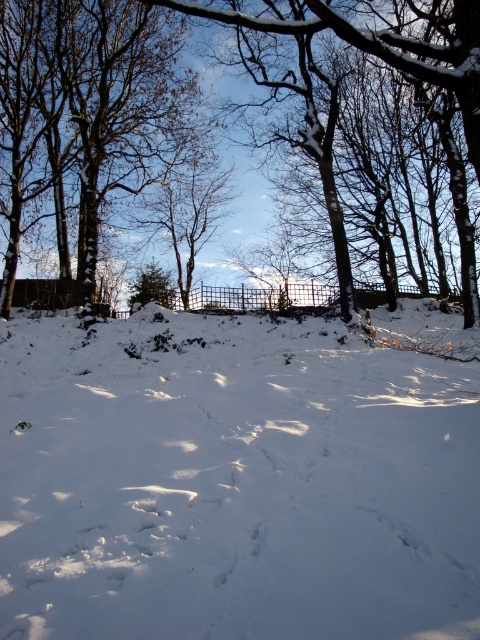
Question: Where is smooth bark tree at upper left located in relation to snow-covered tree at center in the image?

Choices:
 (A) right
 (B) left

Answer: (B)

Question: Which object appears closest to the camera in this image?

Choices:
 (A) snow-covered tree at center
 (B) smooth bark tree at upper left
 (C) white powdery snow at lower center

Answer: (C)

Question: Is white powdery snow at lower center behind smooth bark tree at upper left?

Choices:
 (A) no
 (B) yes

Answer: (A)

Question: Which of these objects is positioned closest to the snow-covered tree at center?

Choices:
 (A) white powdery snow at lower center
 (B) smooth bark tree at upper left

Answer: (B)

Question: Considering the real-world distances, which object is closest to the smooth bark tree at upper left?

Choices:
 (A) snow-covered tree at center
 (B) white powdery snow at lower center

Answer: (A)

Question: Does white powdery snow at lower center appear under smooth bark tree at upper left?

Choices:
 (A) no
 (B) yes

Answer: (B)